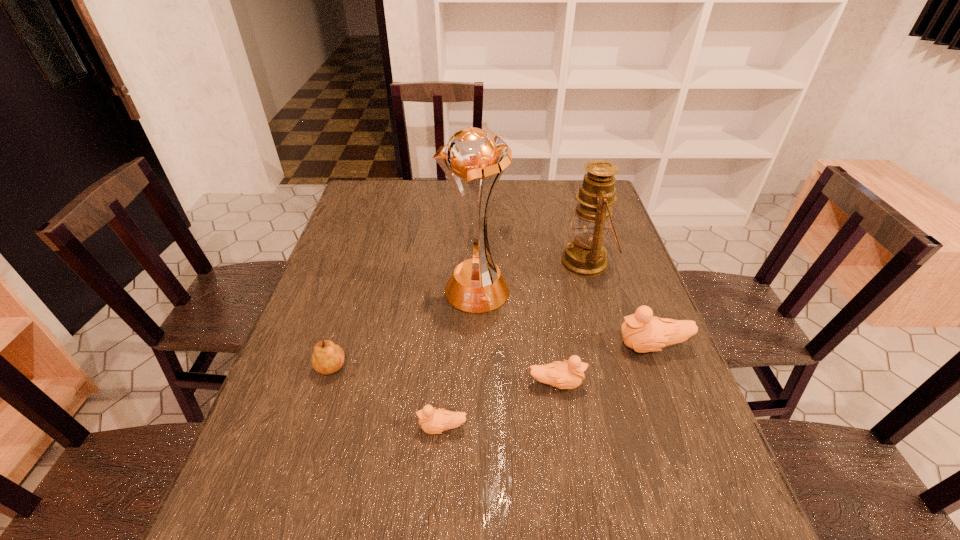
You are a GUI agent. You are given a task and a screenshot of the screen. Output one action in this format:
    pyautogui.click(x=<x>, y=<y>)
    Task: Click on the duckling located in the right edge section of the desktop
    The height and width of the screenshot is (540, 960).
    Given the screenshot: What is the action you would take?
    pyautogui.click(x=642, y=332)

The image size is (960, 540). What are the coordinates of `oil lamp that is at the right edge` in the screenshot? It's located at click(x=585, y=255).

The width and height of the screenshot is (960, 540). I want to click on vacant space at the far edge of the desktop, so click(x=493, y=197).

Find the location of a particular element. The image size is (960, 540). vacant space at the left edge of the desktop is located at coordinates (311, 340).

Find the location of `free region at the right edge of the desktop`. free region at the right edge of the desktop is located at coordinates (621, 352).

In the image, there is a desktop. Where is `vacant space at the far left corner`? The image size is (960, 540). vacant space at the far left corner is located at coordinates (395, 181).

In the image, there is a desktop. Where is `free space at the far right corner`? This screenshot has width=960, height=540. free space at the far right corner is located at coordinates (568, 190).

This screenshot has width=960, height=540. What are the coordinates of `vacant region between the nearest duckling and the oil lamp` in the screenshot? It's located at (515, 345).

The width and height of the screenshot is (960, 540). I want to click on free space between the nearest duckling and the leftmost object, so click(391, 398).

In order to click on vacant area that lies between the tallest object and the leftmost object in this screenshot , I will do `click(407, 329)`.